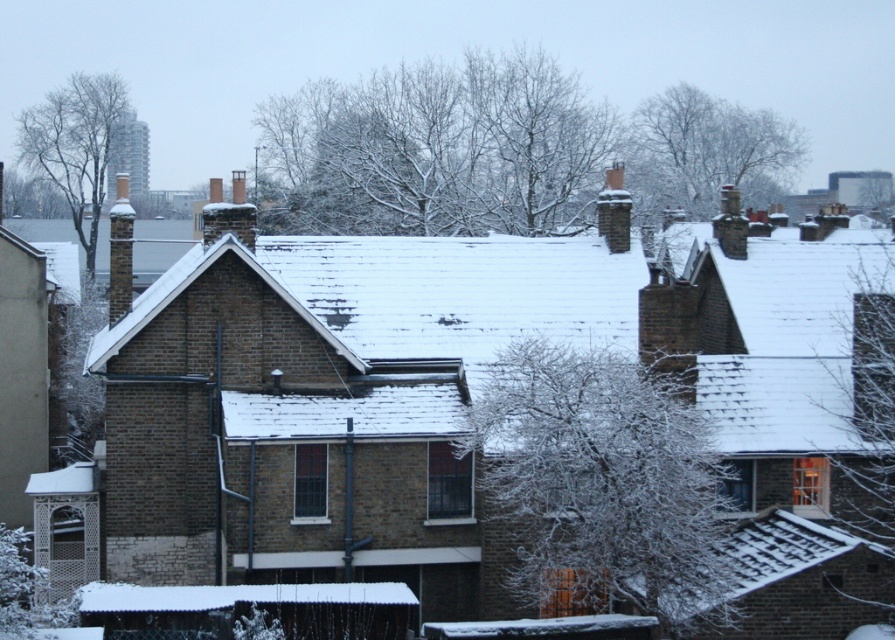
Question: Can you confirm if white frosty branches at center is positioned to the left of snow-covered branches at upper center?

Choices:
 (A) no
 (B) yes

Answer: (B)

Question: Can you confirm if white frosty branches at center is smaller than white frosty tree at upper right?

Choices:
 (A) no
 (B) yes

Answer: (B)

Question: Which point is farther from the camera taking this photo?

Choices:
 (A) (94, 81)
 (B) (699, 168)
 (C) (868, 528)
 (D) (296, 150)

Answer: (A)

Question: Which is farther from the snow-covered branches at upper center?

Choices:
 (A) bare branches at upper left
 (B) white frosty tree at upper right
 (C) white frosty branches at center

Answer: (C)

Question: Among these objects, which one is nearest to the camera?

Choices:
 (A) bare branches at upper left
 (B) white frosty branches at center

Answer: (B)

Question: Is snow-covered branches at upper center smaller than bare branches at upper left?

Choices:
 (A) no
 (B) yes

Answer: (B)